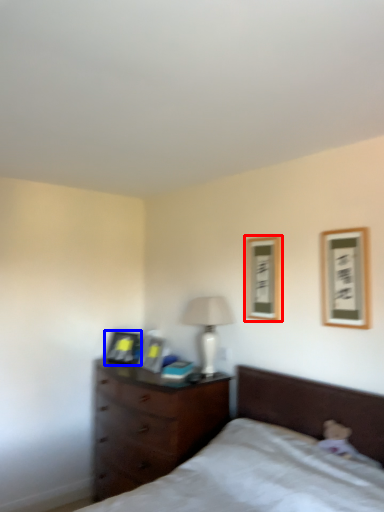
Question: Which of the following is the closest to the observer, picture frame (highlighted by a red box) or picture frame (highlighted by a blue box)?

Choices:
 (A) picture frame
 (B) picture frame

Answer: (A)